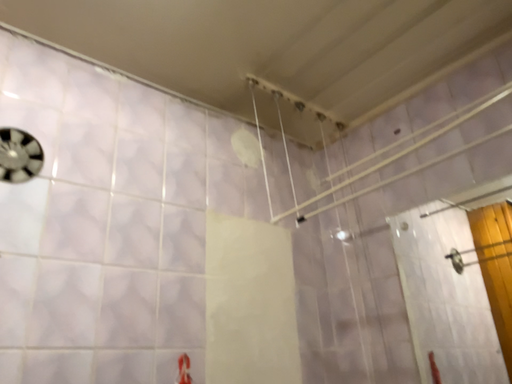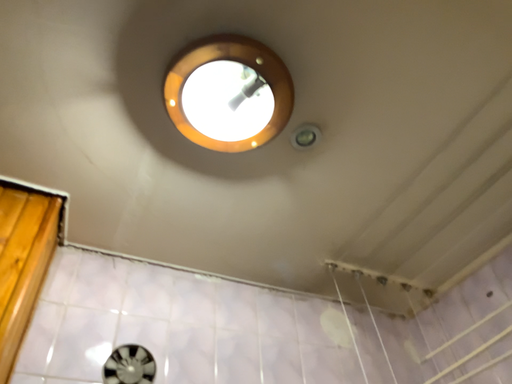
Question: Which way did the camera rotate in the video?

Choices:
 (A) rotated right
 (B) rotated left

Answer: (B)